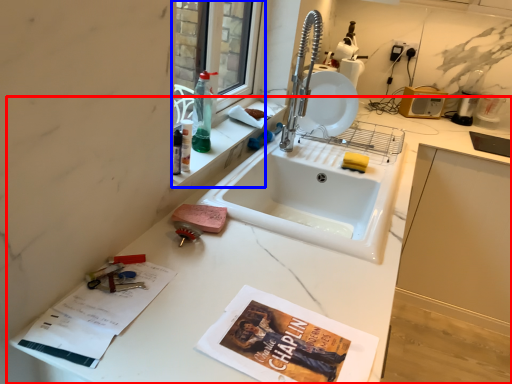
Question: Which object appears farthest to the camera in this image, countertop (highlighted by a red box) or window (highlighted by a blue box)?

Choices:
 (A) countertop
 (B) window

Answer: (B)